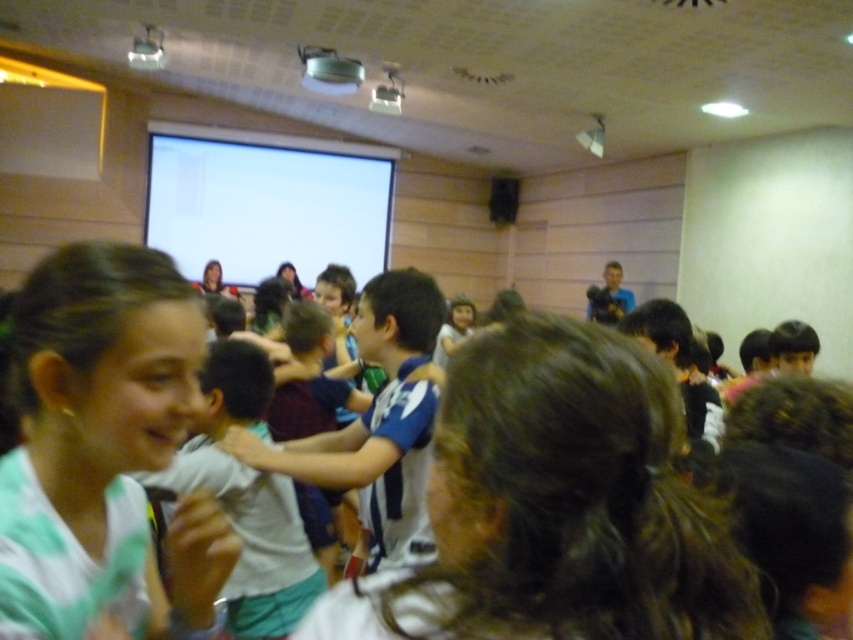
Does white cotton shirt at center have a greater height compared to matte black hair at upper center?

Correct, white cotton shirt at center is much taller as matte black hair at upper center.

Who is higher up, white cotton shirt at center or matte black hair at upper center?

matte black hair at upper center is higher up.

Is point (209, 365) behind point (213, 291)?

That is False.

This screenshot has width=853, height=640. Identify the location of white cotton shirt at center. (247, 499).

Does white glossy projection screen at upper center appear under matte black hair at upper center?

No, white glossy projection screen at upper center is not below matte black hair at upper center.

Consider the image. Does white glossy projection screen at upper center have a greater width compared to matte black hair at upper center?

Correct, the width of white glossy projection screen at upper center exceeds that of matte black hair at upper center.

Who is more distant from viewer, (x=180, y=227) or (x=209, y=284)?

Positioned behind is point (x=180, y=227).

Where is `white glossy projection screen at upper center`? white glossy projection screen at upper center is located at coordinates (265, 202).

Which is more to the left, green matte shirt at center or white glossy projection screen at upper center?

white glossy projection screen at upper center

Is green matte shirt at center smaller than white glossy projection screen at upper center?

Indeed, green matte shirt at center has a smaller size compared to white glossy projection screen at upper center.

This screenshot has height=640, width=853. I want to click on green matte shirt at center, so click(103, 451).